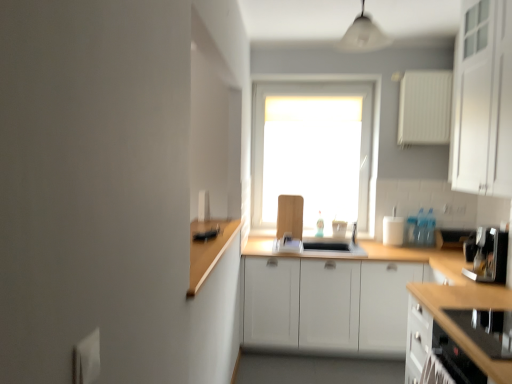
Question: Based on their sizes in the image, would you say white matte cabinet at upper right, which ranks as the first cabinetry in top-to-bottom order, is bigger or smaller than white glossy light fixture at upper center?

Choices:
 (A) small
 (B) big

Answer: (B)

Question: In terms of height, does white matte cabinet at upper right, acting as the 2th cabinetry starting from the bottom, look taller or shorter compared to white glossy light fixture at upper center?

Choices:
 (A) tall
 (B) short

Answer: (A)

Question: Which is farther from the white glossy light fixture at upper center?

Choices:
 (A) white matte cabinet at upper right, which ranks as the first cabinetry in top-to-bottom order
 (B) white matte window at center
 (C) white textured radiator at upper right, the third appliance positioned from the back
 (D) white plastic container at right, acting as the 3th appliance starting from the front
 (E) black glass stovetop at lower right, the 2th cabinetry when ordered from top to bottom

Answer: (E)

Question: Which object is the farthest from the wooden at center?

Choices:
 (A) white textured radiator at upper right, the third appliance positioned from the back
 (B) black glass stovetop at lower right, marked as the first cabinetry in a bottom-to-top arrangement
 (C) white matte window at center
 (D) white matte cabinet at upper right, which ranks as the first cabinetry in top-to-bottom order
 (E) white glossy light fixture at upper center

Answer: (E)